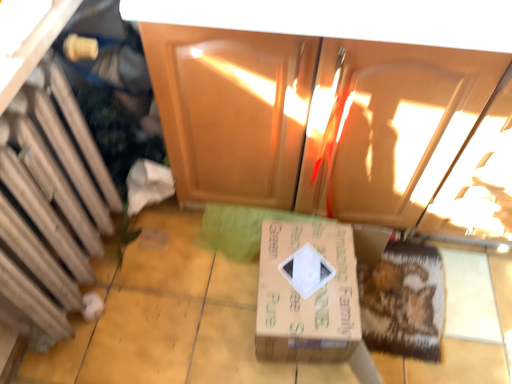
Identify the location of free space above brown cardboard box at center (from a real-world perspective). (316, 279).